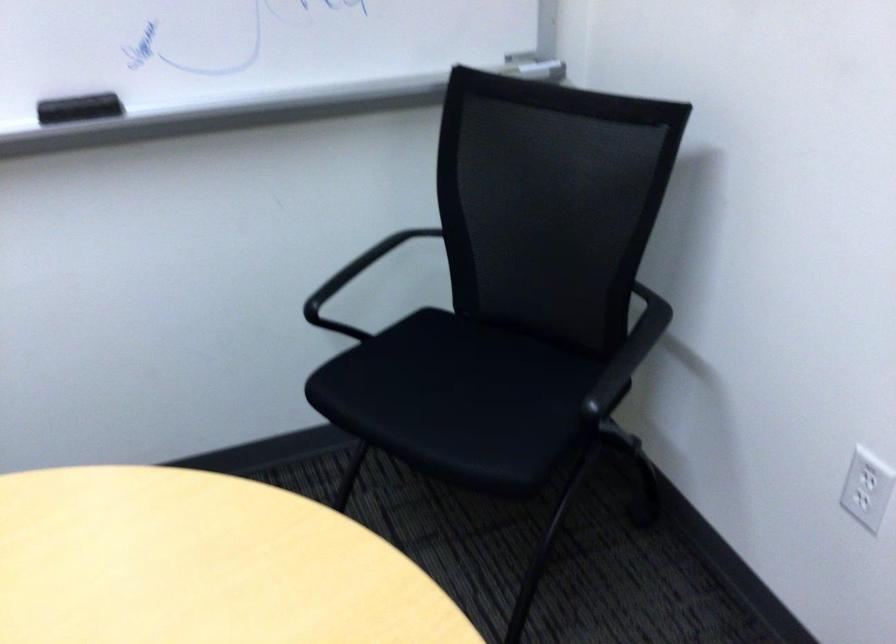
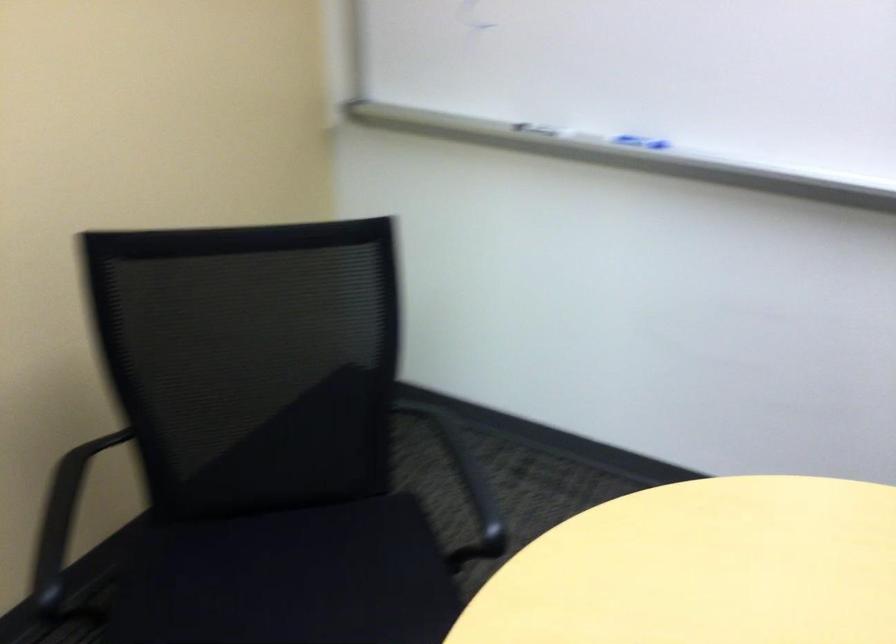
Question: The camera is either moving clockwise (left) or counter-clockwise (right) around the object. The first image is from the beginning of the video and the second image is from the end. Is the camera moving left or right when shooting the video?

Choices:
 (A) Left
 (B) Right

Answer: (B)